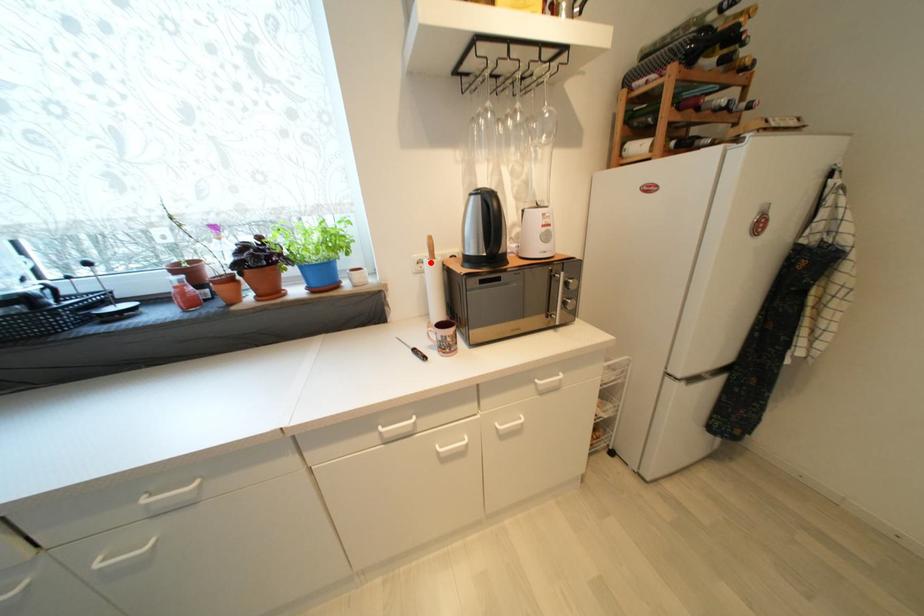
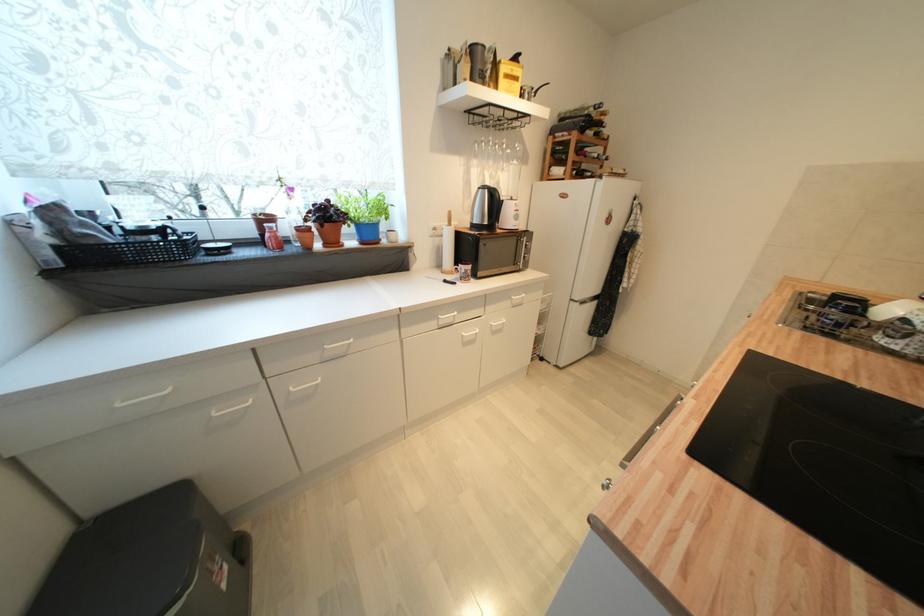
Question: I am providing you with two images of the same scene from different viewpoints. In image1, a red point is highlighted. Considering the same 3D point in image2, which of the following is correct?

Choices:
 (A) It is closer
 (B) It is farther

Answer: (A)